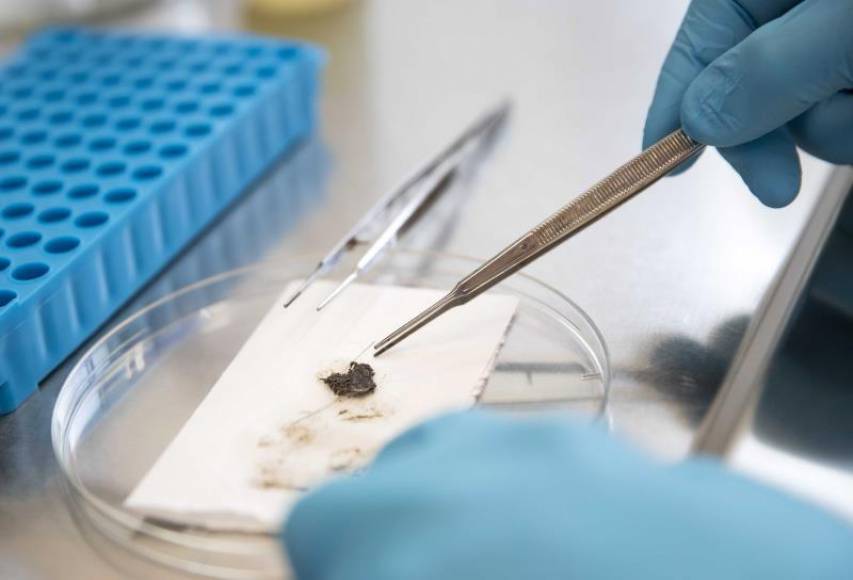
The image size is (853, 580). In order to click on rim of dish in this screenshot , I will do point(67,385).